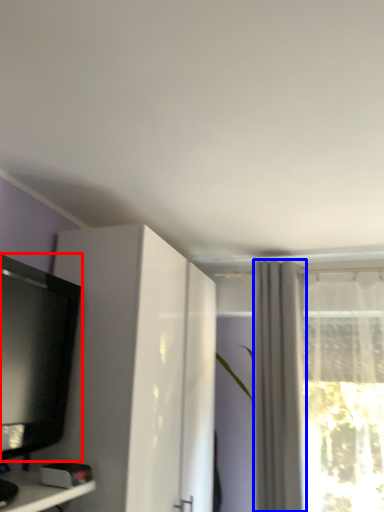
Question: Among these objects, which one is farthest to the camera, television (highlighted by a red box) or curtain (highlighted by a blue box)?

Choices:
 (A) television
 (B) curtain

Answer: (B)